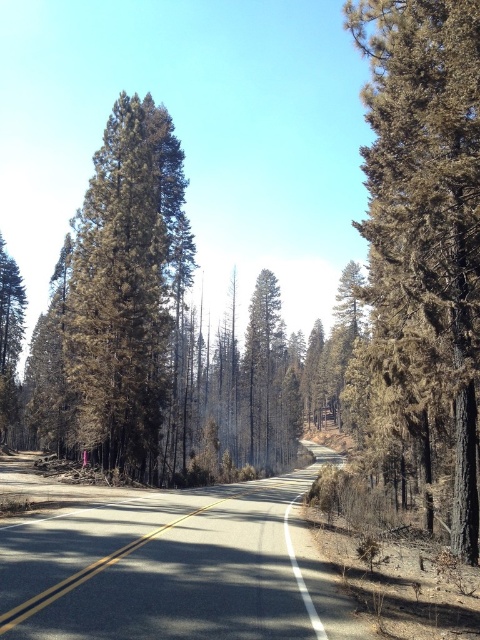
Question: Can you confirm if asphalt road at center is thinner than brown textured tree at center?

Choices:
 (A) yes
 (B) no

Answer: (A)

Question: Which point is farther to the camera?

Choices:
 (A) (446, 200)
 (B) (108, 506)

Answer: (B)

Question: Is asphalt road at center further to camera compared to brown textured tree at center?

Choices:
 (A) yes
 (B) no

Answer: (B)

Question: Observing the image, what is the correct spatial positioning of asphalt road at center in reference to brown textured tree at center?

Choices:
 (A) above
 (B) below

Answer: (B)

Question: Which of the following is the closest to the observer?

Choices:
 (A) asphalt road at center
 (B) brown textured tree at center
 (C) charred bark tree at center

Answer: (A)

Question: Which of the following is the closest to the observer?

Choices:
 (A) asphalt road at center
 (B) brown textured tree at center
 (C) charred bark tree at center

Answer: (A)